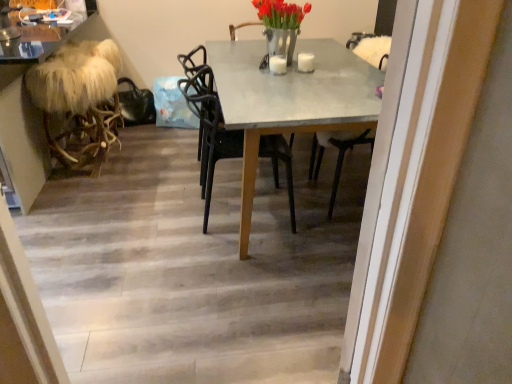
Question: Does concrete gray table at center have a greater width compared to furry white stool at left?

Choices:
 (A) no
 (B) yes

Answer: (B)

Question: From a real-world perspective, does concrete gray table at center sit lower than furry white stool at left?

Choices:
 (A) yes
 (B) no

Answer: (B)

Question: Is the depth of concrete gray table at center greater than that of furry white stool at left?

Choices:
 (A) yes
 (B) no

Answer: (B)

Question: Considering the relative sizes of concrete gray table at center and furry white stool at left in the image provided, is concrete gray table at center smaller than furry white stool at left?

Choices:
 (A) no
 (B) yes

Answer: (A)

Question: From a real-world perspective, is concrete gray table at center located higher than furry white stool at left?

Choices:
 (A) yes
 (B) no

Answer: (A)

Question: Would you say metallic silver vase at upper center is inside or outside black plastic chair at center?

Choices:
 (A) outside
 (B) inside

Answer: (A)

Question: In terms of height, does metallic silver vase at upper center look taller or shorter compared to black plastic chair at center?

Choices:
 (A) short
 (B) tall

Answer: (A)

Question: Considering their positions, is metallic silver vase at upper center located in front of or behind black plastic chair at center?

Choices:
 (A) behind
 (B) front

Answer: (A)

Question: Is metallic silver vase at upper center bigger or smaller than black plastic chair at center?

Choices:
 (A) big
 (B) small

Answer: (B)

Question: From a real-world perspective, is metallic silver vase at upper center above or below wooden floor at center?

Choices:
 (A) above
 (B) below

Answer: (A)

Question: Considering the positions of point (282, 13) and point (264, 337), is point (282, 13) closer or farther from the camera than point (264, 337)?

Choices:
 (A) farther
 (B) closer

Answer: (A)

Question: Is metallic silver vase at upper center bigger or smaller than wooden floor at center?

Choices:
 (A) small
 (B) big

Answer: (A)

Question: Would you say metallic silver vase at upper center is inside or outside wooden floor at center?

Choices:
 (A) inside
 (B) outside

Answer: (B)

Question: Visually, is metallic silver vase at upper center positioned to the left or to the right of furry white stool at left?

Choices:
 (A) right
 (B) left

Answer: (A)

Question: In terms of size, does metallic silver vase at upper center appear bigger or smaller than furry white stool at left?

Choices:
 (A) big
 (B) small

Answer: (B)